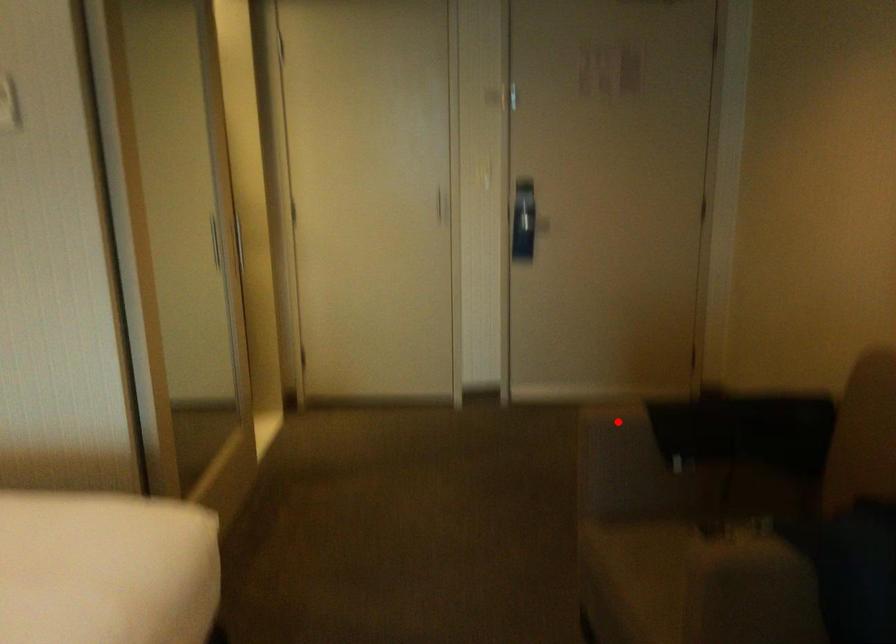
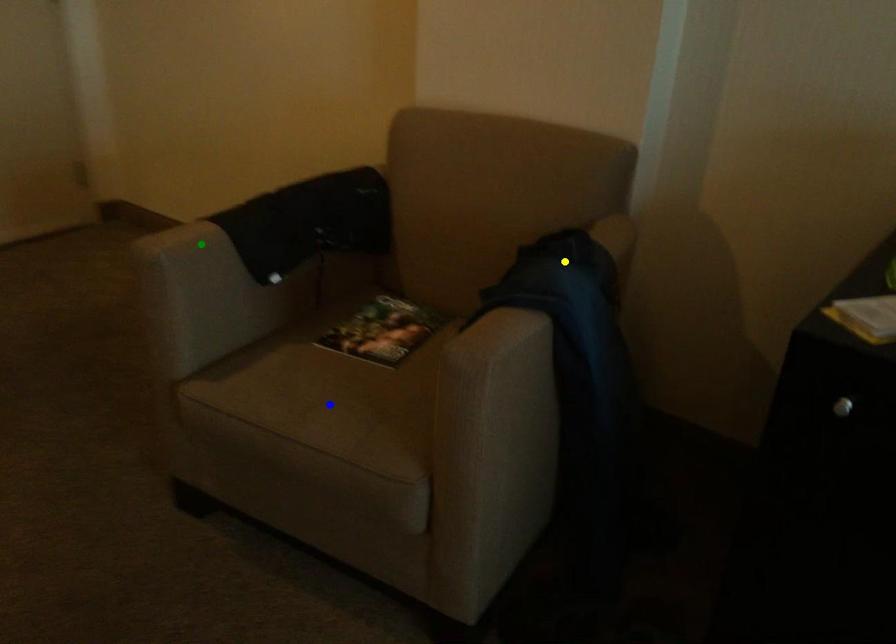
Question: I am providing you with two images of the same scene from different viewpoints. A red point is marked on the first image. You are given multiple points on the second image. Which point in image 2 represents the same 3d spot as the red point in image 1?

Choices:
 (A) green point
 (B) blue point
 (C) yellow point

Answer: (A)